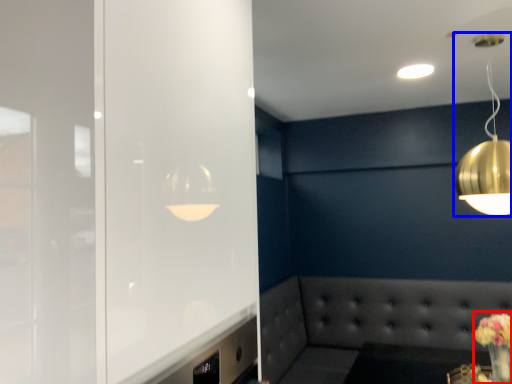
Question: Among these objects, which one is farthest to the camera, floral arrangement (highlighted by a red box) or lamp (highlighted by a blue box)?

Choices:
 (A) floral arrangement
 (B) lamp

Answer: (A)